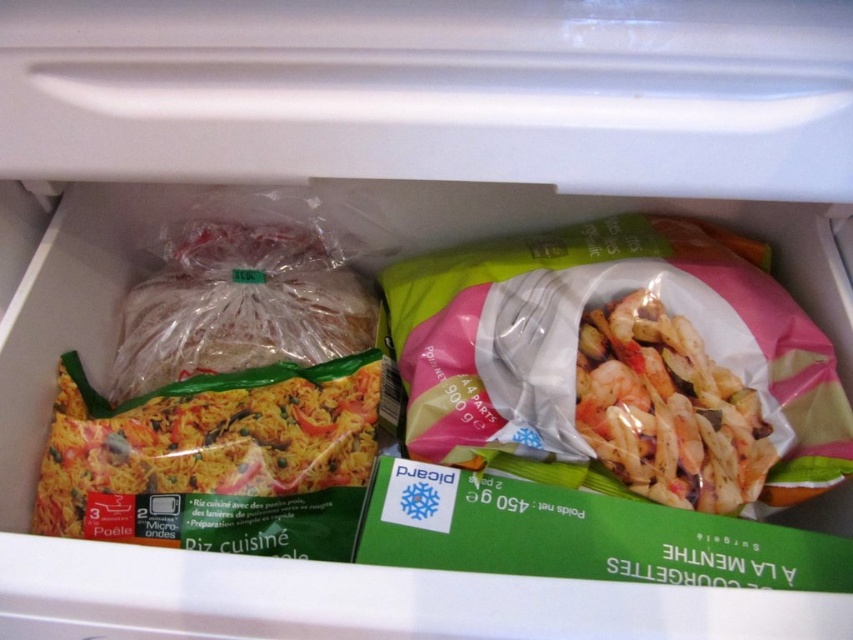
Question: Which object is closer to the camera taking this photo?

Choices:
 (A) green matte rice at center
 (B) pink plastic bag of shrimp at center
 (C) translucent plastic bag of rice at center
 (D) pink matte shrimp at center

Answer: (D)

Question: Is translucent plastic bag of rice at center positioned in front of pink matte shrimp at center?

Choices:
 (A) yes
 (B) no

Answer: (B)

Question: Among these objects, which one is farthest from the camera?

Choices:
 (A) green matte rice at center
 (B) translucent plastic bag of rice at center
 (C) pink matte shrimp at center

Answer: (B)

Question: Based on their relative distances, which object is nearer to the translucent plastic bag of rice at center?

Choices:
 (A) green matte rice at center
 (B) pink plastic bag of shrimp at center
 (C) pink matte shrimp at center

Answer: (A)

Question: Observing the image, what is the correct spatial positioning of pink plastic bag of shrimp at center in reference to translucent plastic bag of rice at center?

Choices:
 (A) above
 (B) below

Answer: (B)

Question: Is translucent plastic bag of rice at center further to camera compared to pink matte shrimp at center?

Choices:
 (A) no
 (B) yes

Answer: (B)